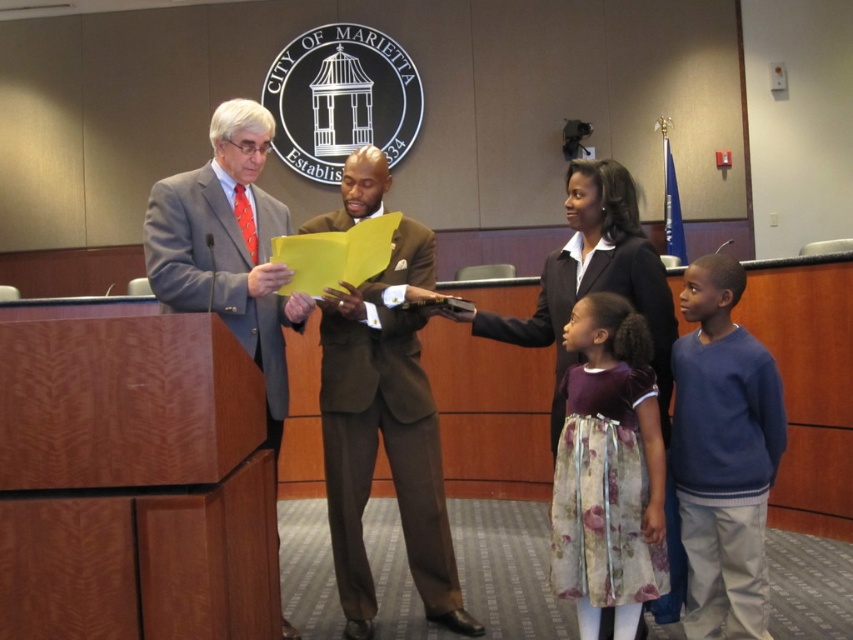
Question: Is matte gray suit at left behind matte black suit at center?

Choices:
 (A) no
 (B) yes

Answer: (A)

Question: Is brown wool suit at center behind floral silk dress at center?

Choices:
 (A) no
 (B) yes

Answer: (B)

Question: Considering the real-world distances, which object is farthest from the matte gray suit at left?

Choices:
 (A) brown wool suit at center
 (B) matte black suit at center
 (C) floral silk dress at center
 (D) blue sweater at right

Answer: (D)

Question: Which of the following is the closest to the observer?

Choices:
 (A) matte gray suit at left
 (B) floral silk dress at center
 (C) matte black suit at center

Answer: (A)

Question: Considering the relative positions of brown wool suit at center and matte black suit at center in the image provided, where is brown wool suit at center located with respect to matte black suit at center?

Choices:
 (A) right
 (B) left

Answer: (B)

Question: Which object is farther from the camera taking this photo?

Choices:
 (A) matte black suit at center
 (B) brown wool suit at center
 (C) floral silk dress at center
 (D) blue sweater at right

Answer: (B)